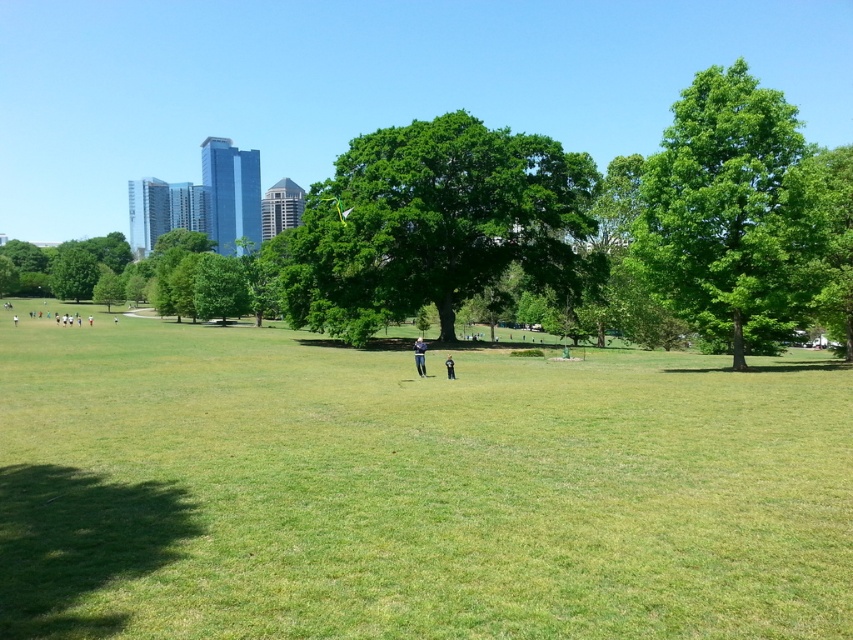
You are standing in the park and want to take a photo of the black fabric person at center. To ensure the green grassy field at center is in focus, should you adjust your camera to focus on a closer or farther subject?

The green grassy field at center is closer to the viewer than the black fabric person at center, so to focus on the green grassy field at center, you should adjust your camera to focus on a closer subject.

You are looking at a park scene with a light blue denim jeans at center and a black fabric person at center. Which object is positioned higher in the image?

The light blue denim jeans at center is above the black fabric person at center in the image.

In the scene shown: You are standing at the point marked by the coordinates point (413, 490) in the park. Looking around, you see the green grassy field at center. Based on your current position, which direction should you walk to reach the nearest tree?

The nearest tree is located to the north of your current position at point (413, 490). You should walk north to reach it.